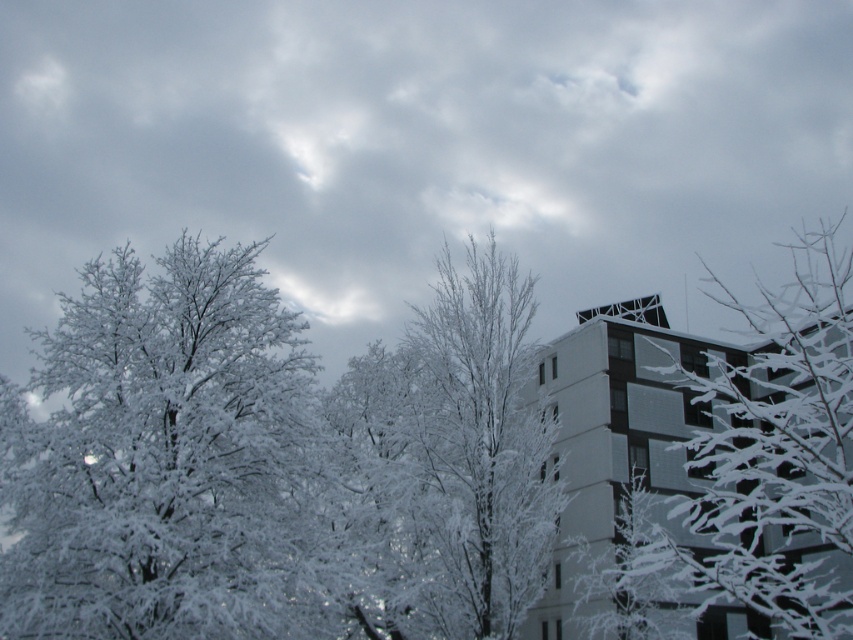
Between cloudy at upper center and white frosty tree at left, which one is positioned lower?

white frosty tree at left is lower down.

Is cloudy at upper center above white frosty tree at left?

Yes.

Between point (166, 230) and point (15, 497), which one is positioned in front?

Point (15, 497) is in front.

Identify the location of cloudy at upper center. This screenshot has width=853, height=640. (421, 147).

Can you confirm if cloudy at upper center is thinner than white frosted branches at upper right?

No, cloudy at upper center is not thinner than white frosted branches at upper right.

Does point (73, 122) come closer to viewer compared to point (850, 451)?

No, it is behind (850, 451).

In order to click on cloudy at upper center in this screenshot , I will do `click(421, 147)`.

Who is positioned more to the right, white frosty tree at left or white frosted branches at upper right?

white frosted branches at upper right is more to the right.

Which is in front, point (218, 339) or point (802, 241)?

Positioned in front is point (802, 241).

Where is `white frosty tree at left`? white frosty tree at left is located at coordinates (172, 461).